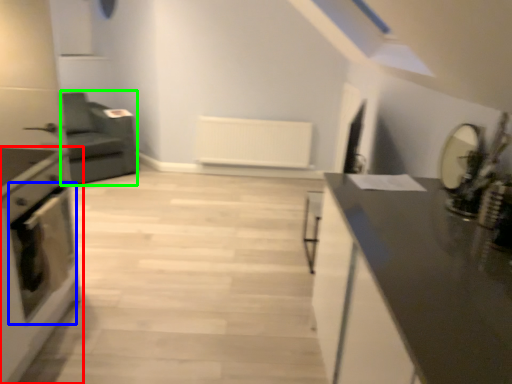
Question: Considering the real-world distances, which object is closest to home appliance (highlighted by a red box)? oven (highlighted by a blue box) or armchair (highlighted by a green box).

Choices:
 (A) oven
 (B) armchair

Answer: (A)